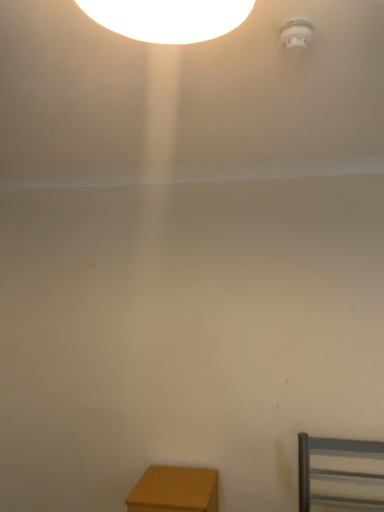
Question: Is matte wood table at lower left in front of or behind white plastic smoke detector at upper right in the image?

Choices:
 (A) behind
 (B) front

Answer: (A)

Question: Would you say matte wood table at lower left is inside or outside white plastic smoke detector at upper right?

Choices:
 (A) inside
 (B) outside

Answer: (B)

Question: Is matte wood table at lower left taller or shorter than white plastic smoke detector at upper right?

Choices:
 (A) tall
 (B) short

Answer: (A)

Question: From the image's perspective, relative to matte wood table at lower left, is white plastic smoke detector at upper right above or below?

Choices:
 (A) above
 (B) below

Answer: (A)

Question: Does point (286, 30) appear closer or farther from the camera than point (150, 504)?

Choices:
 (A) farther
 (B) closer

Answer: (B)

Question: Looking at their shapes, would you say white plastic smoke detector at upper right is wider or thinner than matte wood table at lower left?

Choices:
 (A) thin
 (B) wide

Answer: (A)

Question: Considering the positions of white plastic smoke detector at upper right and matte wood table at lower left in the image, is white plastic smoke detector at upper right bigger or smaller than matte wood table at lower left?

Choices:
 (A) small
 (B) big

Answer: (A)